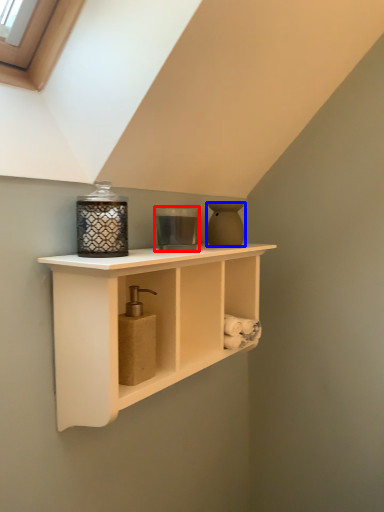
Question: Which object appears closest to the camera in this image, candle holder (highlighted by a red box) or vase (highlighted by a blue box)?

Choices:
 (A) candle holder
 (B) vase

Answer: (A)